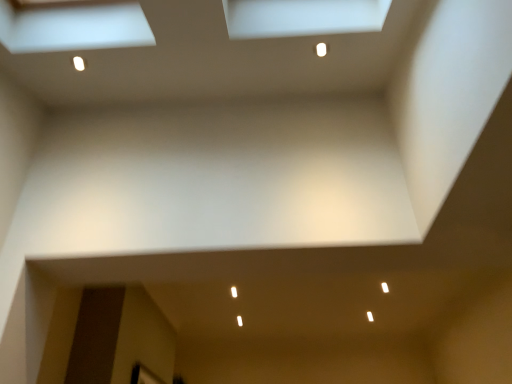
Where is `matte white light at center`? The width and height of the screenshot is (512, 384). matte white light at center is located at coordinates [x=234, y=292].

Describe the element at coordinates (234, 292) in the screenshot. I see `matte white light at center` at that location.

Identify the location of matte white light at center. The image size is (512, 384). pos(234,292).